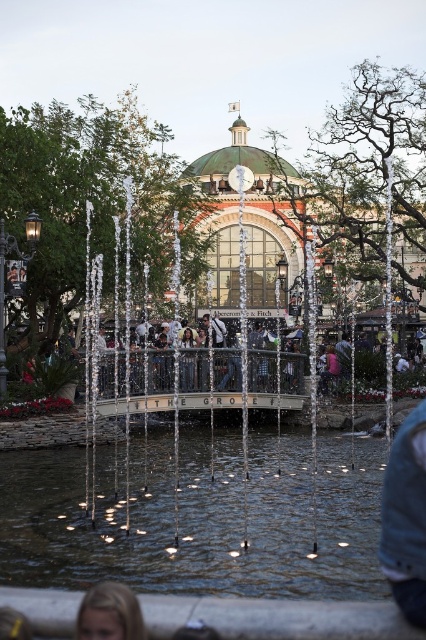
From the picture: You are a photographer standing in the public square and want to capture both the denim jacket at lower right and the blonde hair at lower left in a single frame. Which object should you position closer to the center of your camera viewfinder to ensure both are fully visible?

To ensure both the denim jacket at lower right and the blonde hair at lower left are fully visible in the frame, position the denim jacket at lower right closer to the center of the camera viewfinder since it is wider than the blonde hair at lower left. This adjustment will help accommodate its larger size within the shot.

You are standing in the public square and want to walk from point A to point B. Point A is at coordinate point point (405, 556) and point B is at coordinate point (103, 596). Which point is closer to you when you start walking?

Point (405, 556) is further to the viewer than point (103, 596), so point B at (103, 596) is closer to you when you start walking.